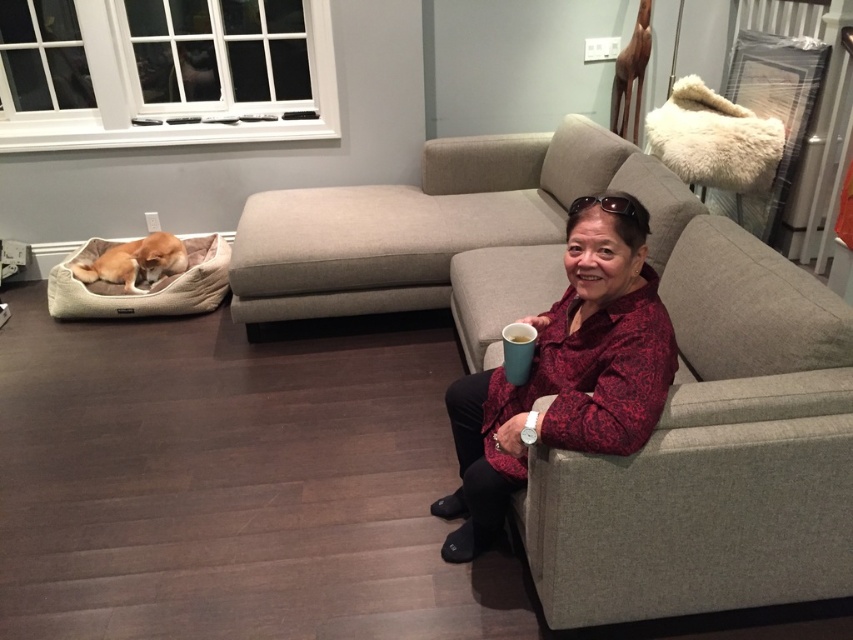
You are a photographer setting up a camera in the living room. The camera is positioned at the center of the room. You want to focus on the matte red blouse at center. Is the camera already aligned to capture the blouse in the frame?

The matte red blouse at center is located at point (566, 372), which is near the center of the frame. Therefore, the camera positioned at the center of the room should already be aligned to capture the blouse in the frame.

You are a photographer taking a picture of the living room scene. You want to ensure both the matte red blouse at center and the teal ceramic mug at upper right are clearly visible. Which object should you focus on first to ensure proper depth of field?

You should focus on the matte red blouse at center first because it is closer to the camera than the teal ceramic mug at upper right. Since it is in front, ensuring it is in focus will help maintain clarity for both objects within the depth of field.

You are a delivery person bringing a 1.2 meter long package to this living room. You need to place it between the matte gray couch at center and the beige fabric dog bed at lower left. Is there enough space for the package to fit horizontally?

The distance between the matte gray couch at center and the beige fabric dog bed at lower left is 1.12 meters. Since the package is 1.2 meters long, it is slightly longer than the available space. Therefore, the package cannot fit horizontally between them.